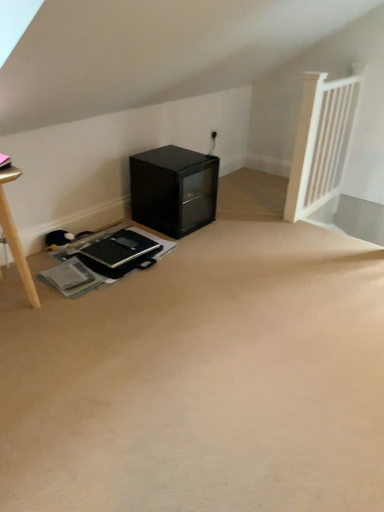
Question: Is black matte laptop at center to the left of black glass cabinet at lower center from the viewer's perspective?

Choices:
 (A) yes
 (B) no

Answer: (A)

Question: Is black matte laptop at center bigger than black glass cabinet at lower center?

Choices:
 (A) no
 (B) yes

Answer: (A)

Question: Is black matte laptop at center aimed at black glass cabinet at lower center?

Choices:
 (A) yes
 (B) no

Answer: (B)

Question: Would you say black matte laptop at center is a long distance from black glass cabinet at lower center?

Choices:
 (A) yes
 (B) no

Answer: (B)

Question: From the image's perspective, is black matte laptop at center below black glass cabinet at lower center?

Choices:
 (A) no
 (B) yes

Answer: (B)

Question: Considering the relative positions of black matte laptop at center and black glass cabinet at lower center in the image provided, is black matte laptop at center in front of black glass cabinet at lower center?

Choices:
 (A) no
 (B) yes

Answer: (B)

Question: Does black glass cabinet at lower center come behind black matte laptop at center?

Choices:
 (A) no
 (B) yes

Answer: (B)

Question: Is black glass cabinet at lower center facing away from black matte laptop at center?

Choices:
 (A) yes
 (B) no

Answer: (B)

Question: Could you tell me if black glass cabinet at lower center is turned towards black matte laptop at center?

Choices:
 (A) no
 (B) yes

Answer: (A)

Question: From a real-world perspective, is black glass cabinet at lower center located higher than black matte laptop at center?

Choices:
 (A) no
 (B) yes

Answer: (B)

Question: Is the position of black glass cabinet at lower center less distant than that of black matte laptop at center?

Choices:
 (A) no
 (B) yes

Answer: (A)

Question: Does black glass cabinet at lower center have a greater height compared to black matte laptop at center?

Choices:
 (A) yes
 (B) no

Answer: (A)

Question: Considering the relative positions of black glass cabinet at lower center and black matte laptop at center in the image provided, is black glass cabinet at lower center to the left or to the right of black matte laptop at center?

Choices:
 (A) left
 (B) right

Answer: (B)